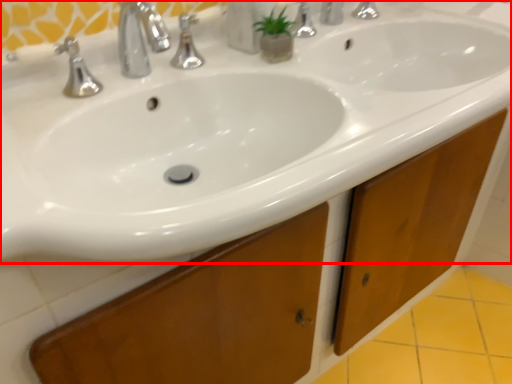
Question: In this image, where is sink (annotated by the red box) located relative to soap dispenser?

Choices:
 (A) left
 (B) right

Answer: (B)